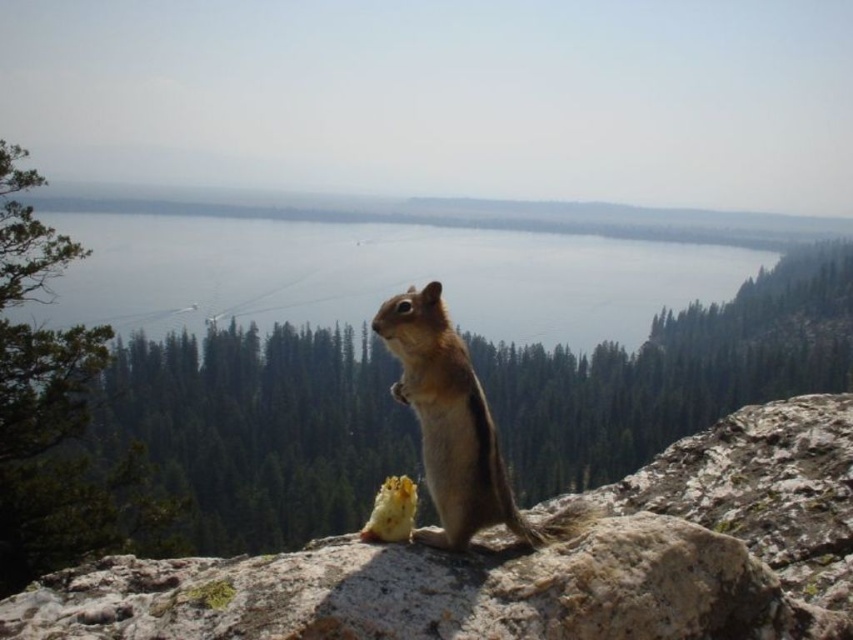
Question: Is gray rock at center further to camera compared to brown furry squirrel at center?

Choices:
 (A) yes
 (B) no

Answer: (B)

Question: Which point appears farthest from the camera in this image?

Choices:
 (A) (735, 515)
 (B) (440, 323)

Answer: (A)

Question: Can you confirm if gray rock at center is positioned to the left of brown furry squirrel at center?

Choices:
 (A) yes
 (B) no

Answer: (B)

Question: Which object is farther from the camera taking this photo?

Choices:
 (A) brown furry squirrel at center
 (B) gray rock at center

Answer: (A)

Question: Does gray rock at center appear over brown furry squirrel at center?

Choices:
 (A) yes
 (B) no

Answer: (B)

Question: Among these objects, which one is nearest to the camera?

Choices:
 (A) brown furry squirrel at center
 (B) gray rock at center

Answer: (B)